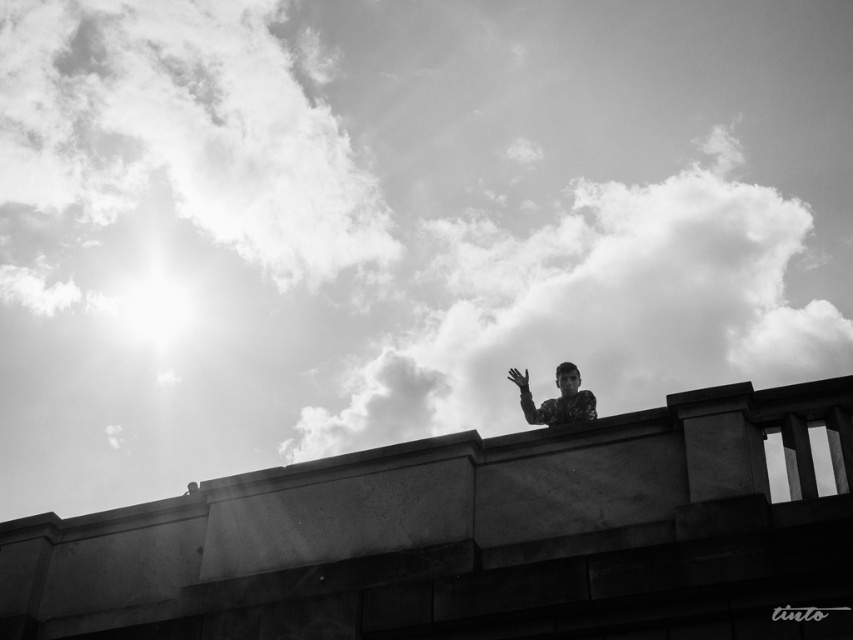
You are a photographer analyzing the composition of this black and white photo. You notice the camouflage fabric person at upper center and the matte black hand at upper center. Which object is positioned higher in the frame?

The matte black hand at upper center is positioned higher in the frame than the camouflage fabric person at upper center.

You are a photographer analyzing the composition of this black and white photo. You notice the camouflage fabric person at upper center and the matte black hand at upper center. Which object is positioned more to the left in the frame?

The matte black hand at upper center is positioned more to the left since the camouflage fabric person at upper center is to the right of it.

You are a photographer analyzing the composition of this black and white photo. You notice the camouflage fabric person at upper center and the matte black hand at upper center. Which object occupies more space in the frame?

The camouflage fabric person at upper center occupies more space in the frame than the matte black hand at upper center because its width is larger.